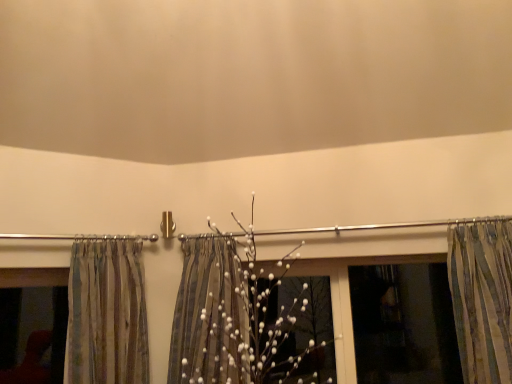
Question: Is transparent plastic window screen at right bigger than matte glass window at left?

Choices:
 (A) no
 (B) yes

Answer: (B)

Question: From the image's perspective, is transparent plastic window screen at right under matte glass window at left?

Choices:
 (A) no
 (B) yes

Answer: (A)

Question: Is transparent plastic window screen at right to the right of matte glass window at left from the viewer's perspective?

Choices:
 (A) no
 (B) yes

Answer: (B)

Question: Is transparent plastic window screen at right with matte glass window at left?

Choices:
 (A) yes
 (B) no

Answer: (B)

Question: Can you confirm if transparent plastic window screen at right is smaller than matte glass window at left?

Choices:
 (A) yes
 (B) no

Answer: (B)

Question: Would you say striped fabric curtain at right, which is the 1th curtain from right to left, is inside or outside matte glass window at left?

Choices:
 (A) outside
 (B) inside

Answer: (A)

Question: From a real-world perspective, is striped fabric curtain at right, the 2th curtain in the left-to-right sequence, above or below matte glass window at left?

Choices:
 (A) above
 (B) below

Answer: (A)

Question: Considering the relative positions of striped fabric curtain at right, which is the 1th curtain from right to left, and matte glass window at left in the image provided, is striped fabric curtain at right, which is the 1th curtain from right to left, to the left or to the right of matte glass window at left?

Choices:
 (A) right
 (B) left

Answer: (A)

Question: In the image, is striped fabric curtain at right, which is the 1th curtain from right to left, positioned in front of or behind matte glass window at left?

Choices:
 (A) front
 (B) behind

Answer: (A)

Question: From a real-world perspective, is transparent plastic window screen at right above or below striped fabric shower curtain at center?

Choices:
 (A) above
 (B) below

Answer: (B)

Question: From their relative heights in the image, would you say transparent plastic window screen at right is taller or shorter than striped fabric shower curtain at center?

Choices:
 (A) tall
 (B) short

Answer: (B)

Question: Would you say transparent plastic window screen at right is inside or outside striped fabric shower curtain at center?

Choices:
 (A) outside
 (B) inside

Answer: (A)

Question: Considering the relative positions of transparent plastic window screen at right and striped fabric shower curtain at center in the image provided, is transparent plastic window screen at right to the left or to the right of striped fabric shower curtain at center?

Choices:
 (A) right
 (B) left

Answer: (A)

Question: From the image's perspective, is striped fabric curtain at left, the 2th curtain from the right, located above or below striped fabric shower curtain at center?

Choices:
 (A) above
 (B) below

Answer: (A)

Question: Choose the correct answer: Is striped fabric curtain at left, the 2th curtain from the right, inside striped fabric shower curtain at center or outside it?

Choices:
 (A) inside
 (B) outside

Answer: (B)